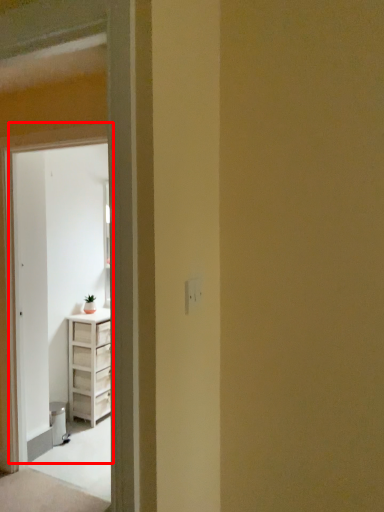
Question: From the image's perspective, considering the relative positions of door (annotated by the red box) and screen door in the image provided, where is door (annotated by the red box) located with respect to the staircase?

Choices:
 (A) below
 (B) above

Answer: (B)